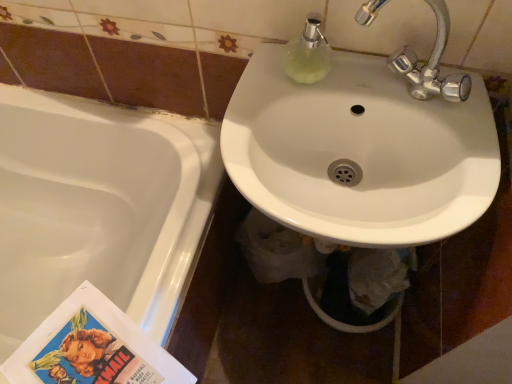
Question: Is point (294, 48) closer or farther from the camera than point (120, 297)?

Choices:
 (A) farther
 (B) closer

Answer: (B)

Question: Based on their sizes in the image, would you say translucent glass soap dispenser at upper center is bigger or smaller than white glossy bathtub at lower left?

Choices:
 (A) big
 (B) small

Answer: (B)

Question: Which object is the farthest from the white glossy bathtub at lower left?

Choices:
 (A) translucent glass soap dispenser at upper center
 (B) white glossy sink at center

Answer: (A)

Question: Which of these objects is positioned closest to the translucent glass soap dispenser at upper center?

Choices:
 (A) white glossy bathtub at lower left
 (B) white glossy sink at center

Answer: (B)